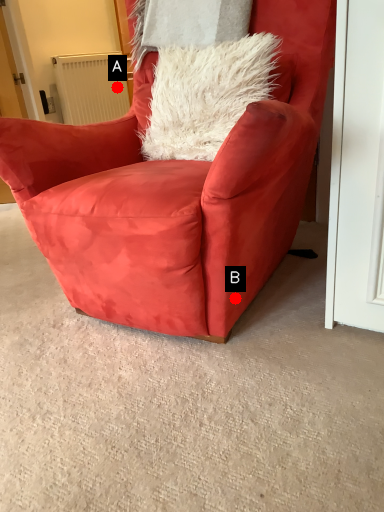
Question: Two points are circled on the image, labeled by A and B beside each circle. Among these points, which one is farthest from the camera?

Choices:
 (A) A is further
 (B) B is further

Answer: (A)